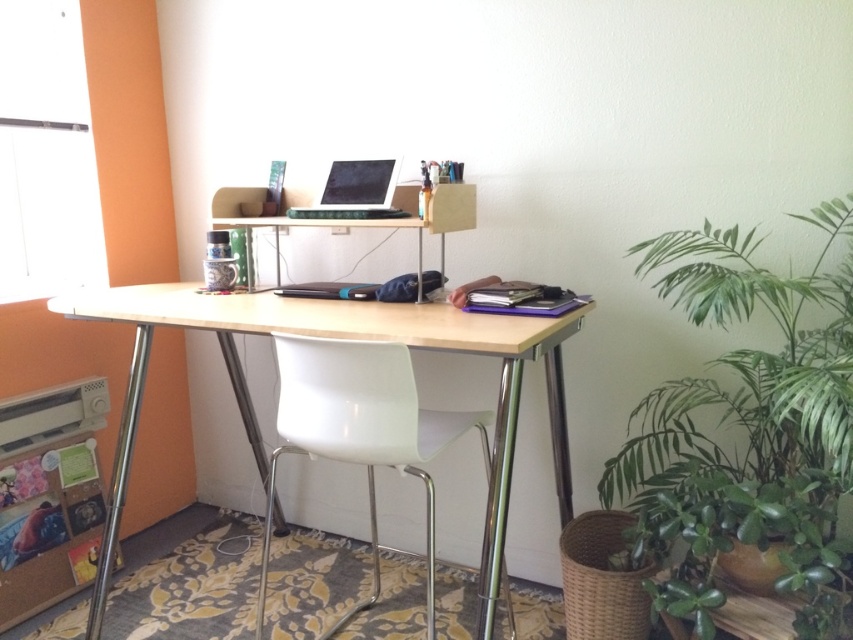
Question: Which object is closer to the camera taking this photo?

Choices:
 (A) white plastic chair at center
 (B) green leafy plant at right
 (C) light wood/wooden desk at center

Answer: (B)

Question: Is white plastic chair at center above satin black laptop at center?

Choices:
 (A) yes
 (B) no

Answer: (B)

Question: Estimate the real-world distances between objects in this image. Which object is farther from the green leafy plant at right?

Choices:
 (A) light wood/wooden desk at center
 (B) satin black laptop at center

Answer: (B)

Question: Is green leafy plant at right positioned in front of white plastic chair at center?

Choices:
 (A) yes
 (B) no

Answer: (A)

Question: Does white plastic chair at center lie in front of satin black laptop at center?

Choices:
 (A) no
 (B) yes

Answer: (B)

Question: Which object is the closest to the satin black laptop at center?

Choices:
 (A) white plastic chair at center
 (B) light wood/wooden desk at center

Answer: (B)